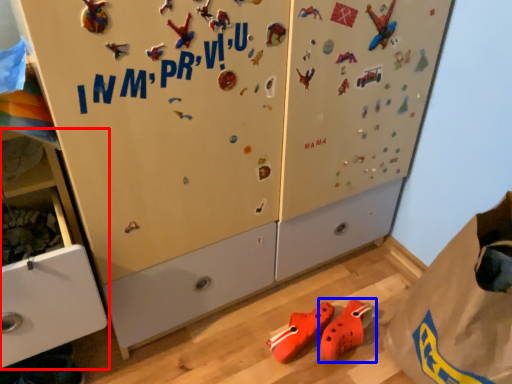
Question: Which object appears closest to the camera in this image, cabinetry (highlighted by a red box) or footwear (highlighted by a blue box)?

Choices:
 (A) cabinetry
 (B) footwear

Answer: (A)